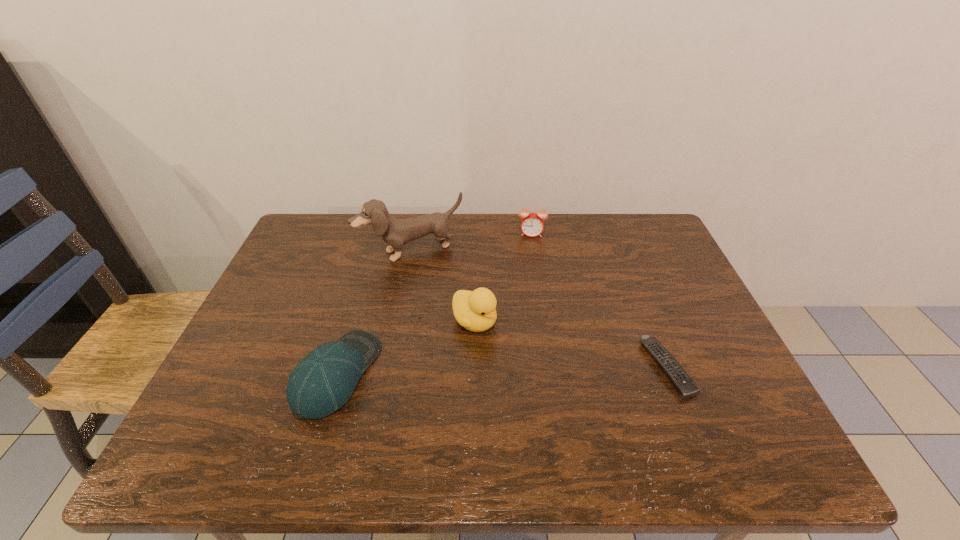
You are a GUI agent. You are given a task and a screenshot of the screen. Output one action in this format:
    pyautogui.click(x=<x>, y=<y>)
    Task: Click on the free space that is in between the duck and the tallest object
    
    Given the screenshot: What is the action you would take?
    pyautogui.click(x=443, y=286)

Find the location of a particular element. This screenshot has width=960, height=540. free space between the puppy and the duck is located at coordinates (443, 286).

The image size is (960, 540). Find the location of `free space between the baseball cap and the puppy`. free space between the baseball cap and the puppy is located at coordinates (374, 312).

Find the location of a particular element. The height and width of the screenshot is (540, 960). vacant space in between the puppy and the baseball cap is located at coordinates (374, 312).

I want to click on unoccupied position between the duck and the shortest object, so click(570, 345).

The height and width of the screenshot is (540, 960). What are the coordinates of `vacant area that lies between the duck and the tallest object` in the screenshot? It's located at (443, 286).

Locate an element on the screen. Image resolution: width=960 pixels, height=540 pixels. free space between the tallest object and the duck is located at coordinates (443, 286).

Find the location of a particular element. vacant area between the fourth tallest object and the duck is located at coordinates (406, 348).

The height and width of the screenshot is (540, 960). In order to click on blank region between the puppy and the baseball cap in this screenshot , I will do `click(374, 312)`.

You are a GUI agent. You are given a task and a screenshot of the screen. Output one action in this format:
    pyautogui.click(x=<x>, y=<y>)
    Task: Click on the vacant region between the alarm clock and the fourth tallest object
    The height and width of the screenshot is (540, 960).
    Given the screenshot: What is the action you would take?
    pyautogui.click(x=435, y=304)